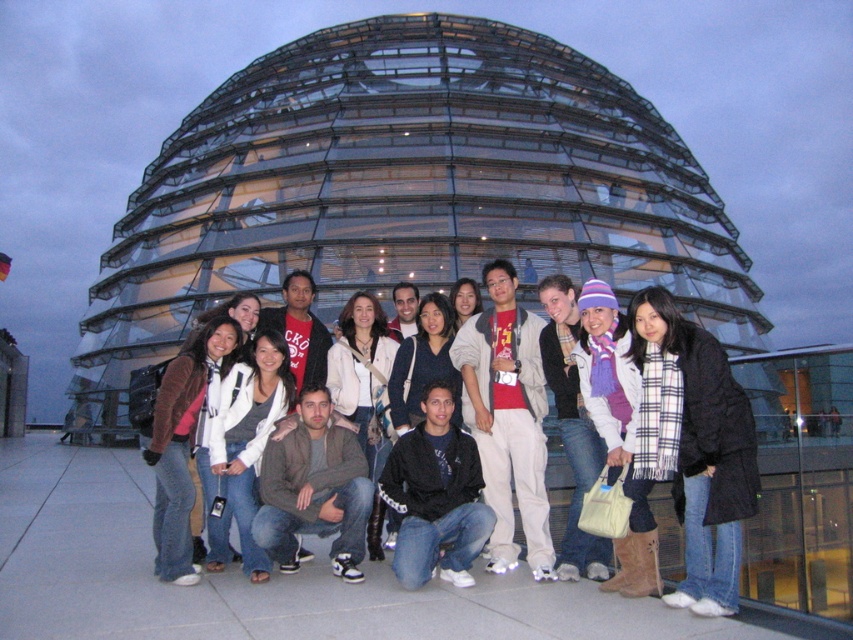
Question: Which of the following is the farthest from the observer?

Choices:
 (A) (519, 477)
 (B) (277, 371)

Answer: (B)

Question: Observing the image, what is the correct spatial positioning of light gray cotton jacket at center in reference to white knit sweater at center?

Choices:
 (A) right
 (B) left

Answer: (A)

Question: Which point is closer to the camera?

Choices:
 (A) light gray cotton jacket at center
 (B) white knit sweater at center

Answer: (B)

Question: From the image, what is the correct spatial relationship of light gray cotton jacket at center in relation to white knit sweater at center?

Choices:
 (A) below
 (B) above

Answer: (B)

Question: Can you confirm if light gray cotton jacket at center is smaller than white knit sweater at center?

Choices:
 (A) no
 (B) yes

Answer: (A)